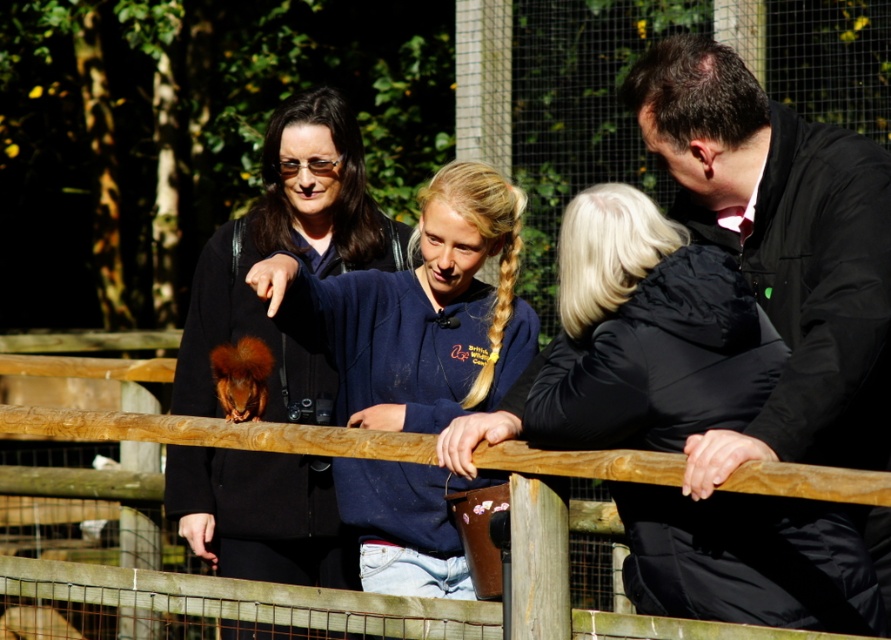
Is black matte jacket at center wider than blue fleece jacket at center?

Yes, black matte jacket at center is wider than blue fleece jacket at center.

Is black matte jacket at center smaller than blue fleece jacket at center?

Yes, black matte jacket at center is smaller than blue fleece jacket at center.

Between point (709, 276) and point (345, 493), which one is positioned in front?

Positioned in front is point (709, 276).

Where is `black matte jacket at center`? Image resolution: width=891 pixels, height=640 pixels. black matte jacket at center is located at coordinates (634, 340).

Is black matte jacket at upper right to the left of matte black jacket at center from the viewer's perspective?

No, black matte jacket at upper right is not to the left of matte black jacket at center.

Is point (767, 193) positioned after point (334, 172)?

No.

The width and height of the screenshot is (891, 640). What are the coordinates of `black matte jacket at upper right` in the screenshot? It's located at (781, 252).

Can you confirm if black matte jacket at upper right is wider than blue fleece jacket at center?

Incorrect, black matte jacket at upper right's width does not surpass blue fleece jacket at center's.

Does black matte jacket at upper right have a larger size compared to blue fleece jacket at center?

Actually, black matte jacket at upper right might be smaller than blue fleece jacket at center.

Between point (755, 259) and point (406, 342), which one is positioned behind?

The point (406, 342) is behind.

Identify the location of black matte jacket at upper right. (781, 252).